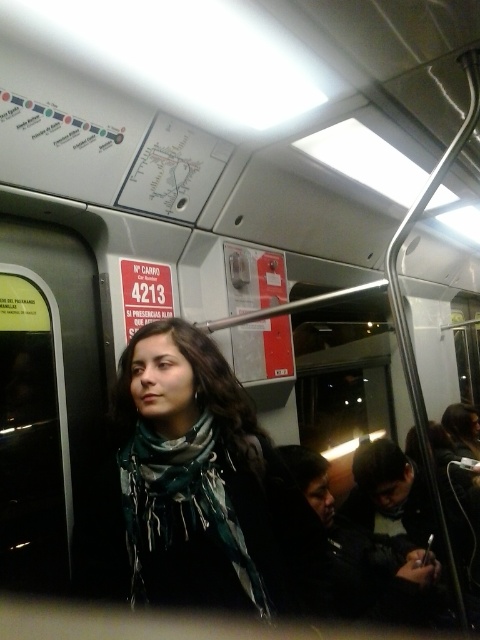
Between green scarf at center and patterned silk scarf at center, which one is positioned lower?

patterned silk scarf at center

Between point (190, 573) and point (168, 460), which one is positioned in front?

Point (190, 573) is more forward.

The height and width of the screenshot is (640, 480). What do you see at coordinates (195, 486) in the screenshot?
I see `green scarf at center` at bounding box center [195, 486].

At what (x,y) coordinates should I click in order to perform the action: click on green scarf at center. Please return your answer as a coordinate pair (x, y). The image size is (480, 640). Looking at the image, I should click on [195, 486].